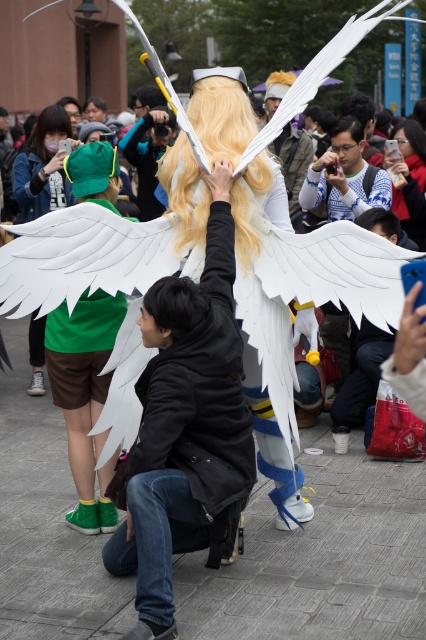
Question: Which object appears farthest from the camera in this image?

Choices:
 (A) matte black camera at center
 (B) blue striped shirt at center

Answer: (A)

Question: Is blonde hair at center closer to camera compared to golden hair at center?

Choices:
 (A) no
 (B) yes

Answer: (B)

Question: Can you confirm if green fabric wings at left is thinner than matte black camera at center?

Choices:
 (A) no
 (B) yes

Answer: (A)

Question: Which point is farther to the camera?

Choices:
 (A) blonde hair at center
 (B) matte white wings at center
 (C) golden hair at center

Answer: (C)

Question: Among these objects, which one is farthest from the camera?

Choices:
 (A) brown matte wig at upper left
 (B) golden hair at center
 (C) matte black camera at center

Answer: (C)

Question: Is golden hair at center behind brown matte wig at upper left?

Choices:
 (A) no
 (B) yes

Answer: (B)